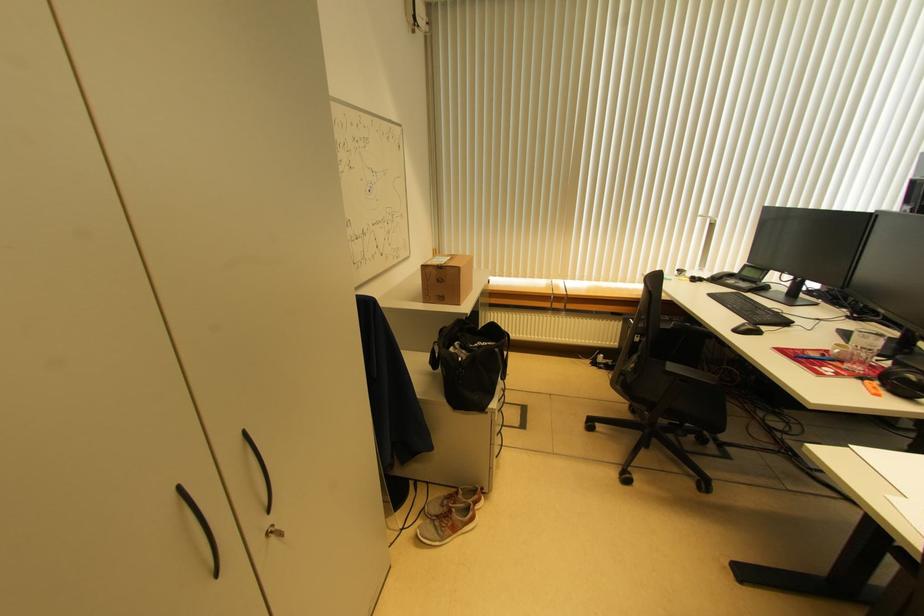
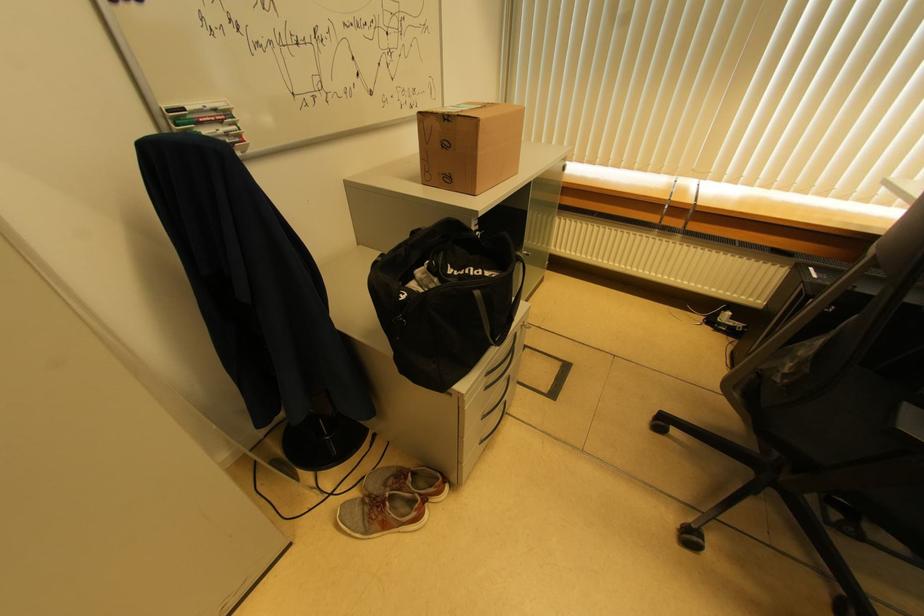
From the picture: First-person continuous shooting, in which direction is the camera rotating?

The camera rotated toward left-down.